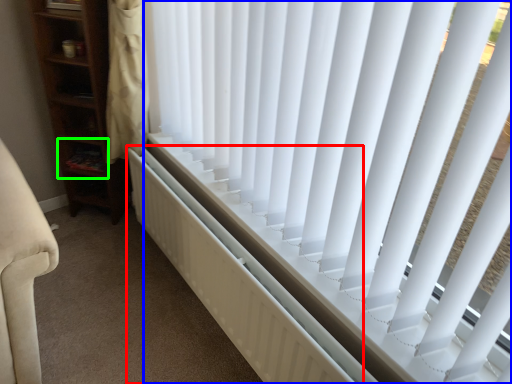
Question: Considering the real-world distances, which object is closest to radiator (highlighted by a red box)? window blind (highlighted by a blue box) or shelf (highlighted by a green box).

Choices:
 (A) window blind
 (B) shelf

Answer: (A)